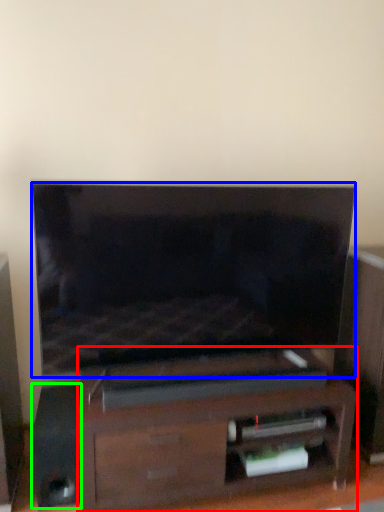
Question: Which object is positioned closest to furniture (highlighted by a red box)? Select from television (highlighted by a blue box) and speaker (highlighted by a green box).

Choices:
 (A) television
 (B) speaker

Answer: (A)